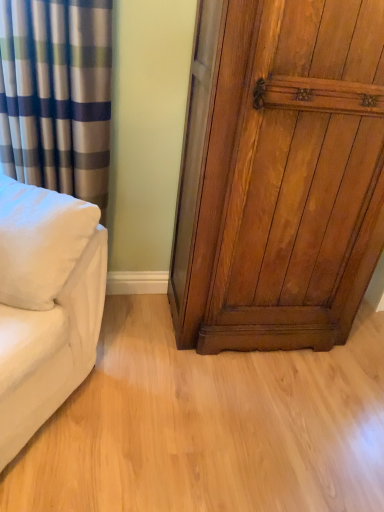
Where is `vacant space that's between silky blue-green striped curtain at left and shiny brown wood door at right`? This screenshot has width=384, height=512. vacant space that's between silky blue-green striped curtain at left and shiny brown wood door at right is located at coordinates (139, 324).